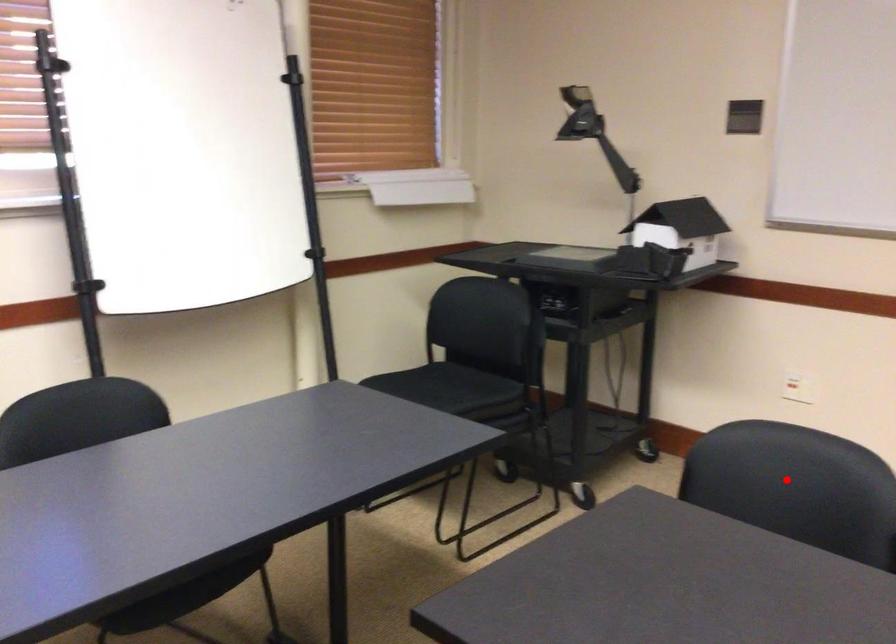
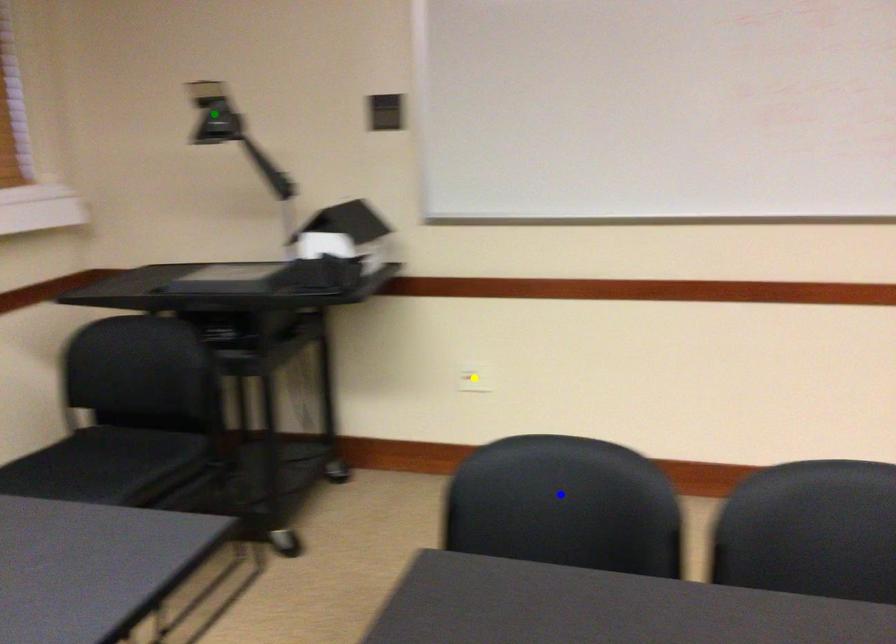
Question: I am providing you with two images of the same scene from different viewpoints. A red point is marked on the first image. You are given multiple points on the second image. Which spot in image 2 lines up with the point in image 1?

Choices:
 (A) green point
 (B) blue point
 (C) yellow point

Answer: (B)